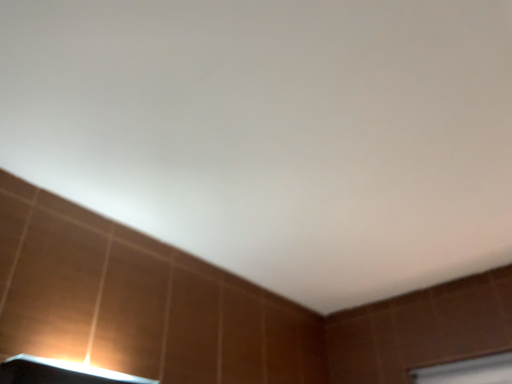
Locate an element on the screen. The height and width of the screenshot is (384, 512). brown wooden window frame at lower right is located at coordinates (468, 371).

What do you see at coordinates (468, 371) in the screenshot? The image size is (512, 384). I see `brown wooden window frame at lower right` at bounding box center [468, 371].

Measure the distance between point (497, 379) and camera.

They are 5.54 feet apart.

This screenshot has width=512, height=384. What do you see at coordinates (60, 373) in the screenshot?
I see `matte white lamp at lower left` at bounding box center [60, 373].

Measure the distance between matte white lamp at lower left and camera.

A distance of 36.14 inches exists between matte white lamp at lower left and camera.

This screenshot has height=384, width=512. Find the location of `matte white lamp at lower left`. matte white lamp at lower left is located at coordinates tap(60, 373).

In order to click on brown wooden window frame at lower right in this screenshot , I will do `click(468, 371)`.

Considering the positions of objects matte white lamp at lower left and brown wooden window frame at lower right in the image provided, who is more to the right, matte white lamp at lower left or brown wooden window frame at lower right?

From the viewer's perspective, brown wooden window frame at lower right appears more on the right side.

Between matte white lamp at lower left and brown wooden window frame at lower right, which one is positioned behind?

brown wooden window frame at lower right is further from the camera.

Between point (30, 359) and point (459, 361), which one is positioned behind?

The point (459, 361) is farther from the camera.

From the image's perspective, is matte white lamp at lower left over brown wooden window frame at lower right?

Correct, matte white lamp at lower left appears higher than brown wooden window frame at lower right in the image.

From a real-world perspective, is matte white lamp at lower left on top of brown wooden window frame at lower right?

No, from a real-world perspective, matte white lamp at lower left is not on top of brown wooden window frame at lower right.

Is matte white lamp at lower left wider than brown wooden window frame at lower right?

Indeed, matte white lamp at lower left has a greater width compared to brown wooden window frame at lower right.

From their relative heights in the image, would you say matte white lamp at lower left is taller or shorter than brown wooden window frame at lower right?

matte white lamp at lower left is shorter than brown wooden window frame at lower right.

Does matte white lamp at lower left have a larger size compared to brown wooden window frame at lower right?

Indeed, matte white lamp at lower left has a larger size compared to brown wooden window frame at lower right.

Is matte white lamp at lower left not within brown wooden window frame at lower right?

matte white lamp at lower left lies outside brown wooden window frame at lower right's area.

Is matte white lamp at lower left not near brown wooden window frame at lower right?

Yes, matte white lamp at lower left and brown wooden window frame at lower right are located far from each other.

Is matte white lamp at lower left positioned with its back to brown wooden window frame at lower right?

No, matte white lamp at lower left's orientation is not away from brown wooden window frame at lower right.

Can you tell me how much matte white lamp at lower left and brown wooden window frame at lower right differ in facing direction?

The facing directions of matte white lamp at lower left and brown wooden window frame at lower right are 89.9 degrees apart.

At what (x,y) coordinates should I click in order to perform the action: click on lamp in front of the brown wooden window frame at lower right. Please return your answer as a coordinate pair (x, y). Image resolution: width=512 pixels, height=384 pixels. Looking at the image, I should click on (60, 373).

Between brown wooden window frame at lower right and matte white lamp at lower left, which one appears on the right side from the viewer's perspective?

brown wooden window frame at lower right is more to the right.

In the scene shown: Is brown wooden window frame at lower right closer to camera compared to matte white lamp at lower left?

No, it is behind matte white lamp at lower left.

Is point (426, 369) closer or farther from the camera than point (98, 373)?

Point (426, 369).

Looking at this image, from the image's perspective, which one is positioned higher, brown wooden window frame at lower right or matte white lamp at lower left?

From the image's view, matte white lamp at lower left is above.

From a real-world perspective, does brown wooden window frame at lower right sit lower than matte white lamp at lower left?

No, from a real-world perspective, brown wooden window frame at lower right is not below matte white lamp at lower left.

In the scene shown: Is brown wooden window frame at lower right thinner than matte white lamp at lower left?

Correct, the width of brown wooden window frame at lower right is less than that of matte white lamp at lower left.

Consider the image. Can you confirm if brown wooden window frame at lower right is taller than matte white lamp at lower left?

Yes.

Is brown wooden window frame at lower right smaller than matte white lamp at lower left?

Indeed, brown wooden window frame at lower right has a smaller size compared to matte white lamp at lower left.

Do you think brown wooden window frame at lower right is within matte white lamp at lower left, or outside of it?

brown wooden window frame at lower right exists outside the volume of matte white lamp at lower left.

Are brown wooden window frame at lower right and matte white lamp at lower left far apart?

Yes, brown wooden window frame at lower right is far from matte white lamp at lower left.

Is brown wooden window frame at lower right looking in the opposite direction of matte white lamp at lower left?

No.

Find the location of `lamp on the left of brown wooden window frame at lower right`. lamp on the left of brown wooden window frame at lower right is located at coordinates (60, 373).

This screenshot has height=384, width=512. Identify the location of window frame above the matte white lamp at lower left (from a real-world perspective). (468, 371).

This screenshot has width=512, height=384. What are the coordinates of `window frame below the matte white lamp at lower left (from the image's perspective)` in the screenshot? It's located at (468, 371).